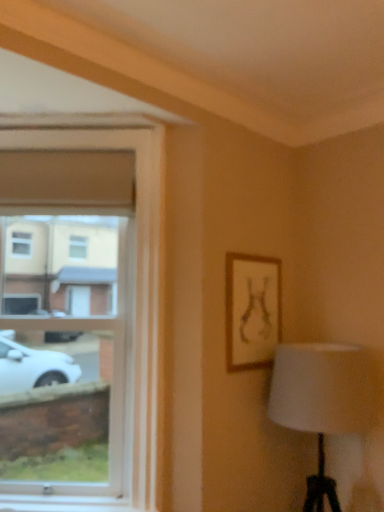
The height and width of the screenshot is (512, 384). What do you see at coordinates (136, 270) in the screenshot? I see `clear glass window at left` at bounding box center [136, 270].

You are a GUI agent. You are given a task and a screenshot of the screen. Output one action in this format:
    pyautogui.click(x=<x>, y=<y>)
    Task: Click on the clear glass window at left
    The height and width of the screenshot is (512, 384).
    Given the screenshot: What is the action you would take?
    pyautogui.click(x=136, y=270)

You are a GUI agent. You are given a task and a screenshot of the screen. Output one action in this format:
    pyautogui.click(x=<x>, y=<y>)
    Task: Click on the wooden frame at upper right
    Image resolution: width=384 pixels, height=512 pixels.
    Given the screenshot: What is the action you would take?
    pyautogui.click(x=252, y=310)

What do you see at coordinates (252, 310) in the screenshot?
I see `wooden frame at upper right` at bounding box center [252, 310].

Where is `clear glass window at left`? This screenshot has height=512, width=384. clear glass window at left is located at coordinates (136, 270).

Is wooden frame at upper right at the left side of clear glass window at left?

No, wooden frame at upper right is not to the left of clear glass window at left.

Is wooden frame at upper right in front of or behind clear glass window at left in the image?

wooden frame at upper right is behind clear glass window at left.

Considering the positions of point (251, 260) and point (159, 180), is point (251, 260) closer or farther from the camera than point (159, 180)?

Point (251, 260) is positioned farther from the camera compared to point (159, 180).

From the image's perspective, which is above, wooden frame at upper right or clear glass window at left?

clear glass window at left, from the image's perspective.

From a real-world perspective, which is physically below, wooden frame at upper right or clear glass window at left?

wooden frame at upper right.

Which of these two, wooden frame at upper right or clear glass window at left, is wider?

clear glass window at left.

Which of these two, wooden frame at upper right or clear glass window at left, stands taller?

Result: clear glass window at left.

Considering the relative sizes of wooden frame at upper right and clear glass window at left in the image provided, is wooden frame at upper right bigger than clear glass window at left?

No.

Based on the photo, do you think wooden frame at upper right is within clear glass window at left, or outside of it?

wooden frame at upper right is outside clear glass window at left.

Are wooden frame at upper right and clear glass window at left far apart?

That's not correct — wooden frame at upper right is a little close to clear glass window at left.

Is wooden frame at upper right oriented towards clear glass window at left?

No, wooden frame at upper right is not facing towards clear glass window at left.

Locate an element on the screen. The image size is (384, 512). window located above the wooden frame at upper right (from the image's perspective) is located at coordinates (136, 270).

Is clear glass window at left at the right side of wooden frame at upper right?

Incorrect, clear glass window at left is not on the right side of wooden frame at upper right.

Which is behind, clear glass window at left or wooden frame at upper right?

Positioned behind is wooden frame at upper right.

Which point is more distant from viewer, (154, 357) or (264, 316)?

The point (264, 316) is behind.

From the image's perspective, which one is positioned higher, clear glass window at left or wooden frame at upper right?

clear glass window at left, from the image's perspective.

From a real-world perspective, between clear glass window at left and wooden frame at upper right, who is vertically lower?

wooden frame at upper right, from a real-world perspective.

Which object is thinner, clear glass window at left or wooden frame at upper right?

Thinner between the two is wooden frame at upper right.

From their relative heights in the image, would you say clear glass window at left is taller or shorter than wooden frame at upper right?

In the image, clear glass window at left appears to be taller than wooden frame at upper right.

Is clear glass window at left bigger or smaller than wooden frame at upper right?

Clearly, clear glass window at left is larger in size than wooden frame at upper right.

Does clear glass window at left contain wooden frame at upper right?

That's incorrect, wooden frame at upper right is not inside clear glass window at left.

Is clear glass window at left positioned far away from wooden frame at upper right?

No, there isn't a large distance between clear glass window at left and wooden frame at upper right.

Is wooden frame at upper right at the back of clear glass window at left?

clear glass window at left is not turned away from wooden frame at upper right.

How many degrees apart are the facing directions of clear glass window at left and wooden frame at upper right?

The facing directions of clear glass window at left and wooden frame at upper right are 45.7 degrees apart.

Measure the distance from clear glass window at left to wooden frame at upper right.

clear glass window at left is 60.86 centimeters away from wooden frame at upper right.

The image size is (384, 512). What are the coordinates of `picture frame below the clear glass window at left (from the image's perspective)` in the screenshot? It's located at (252, 310).

Locate an element on the screen. window on the left of wooden frame at upper right is located at coordinates (136, 270).

Where is `picture frame below the clear glass window at left (from a real-world perspective)`? picture frame below the clear glass window at left (from a real-world perspective) is located at coordinates (252, 310).